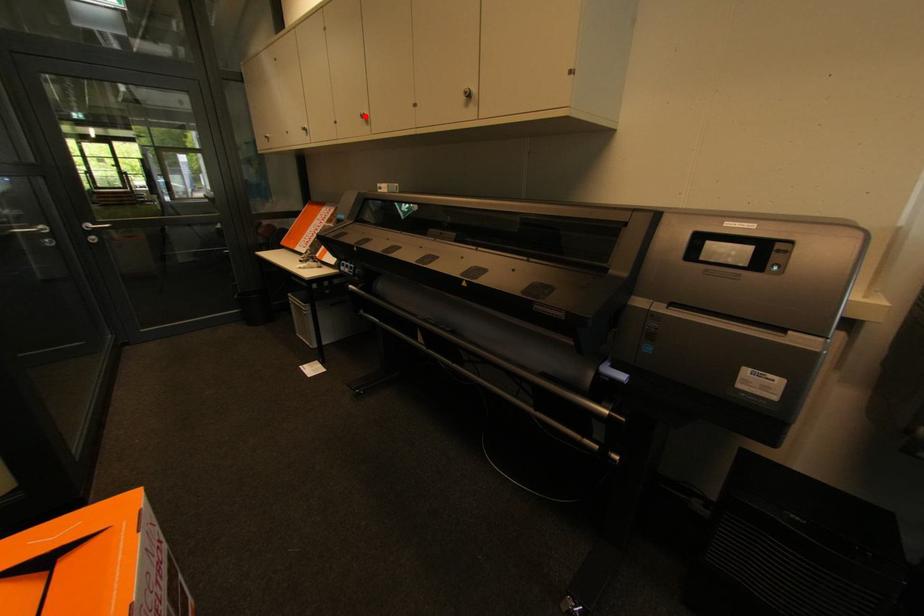
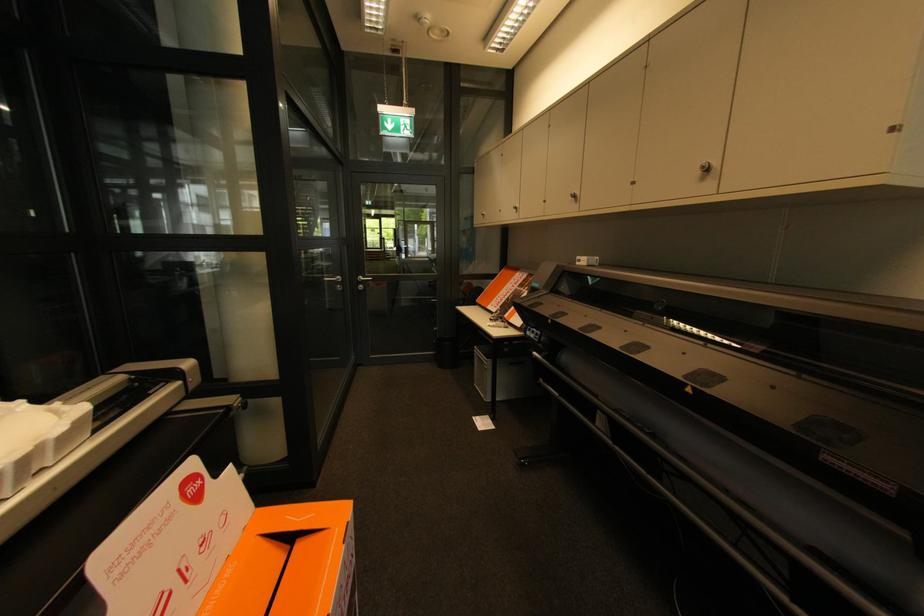
The point at the highlighted location is marked in the first image. Where is the corresponding point in the second image?

(576, 196)